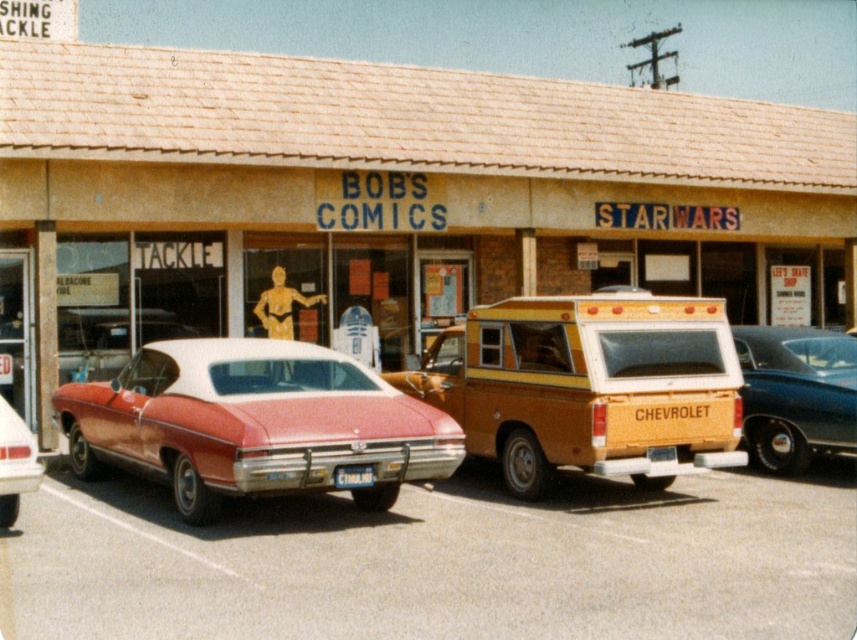
Question: Considering the relative positions of shiny red car at left and shiny blue sedan at right in the image provided, where is shiny red car at left located with respect to shiny blue sedan at right?

Choices:
 (A) left
 (B) right

Answer: (A)

Question: Which of the following is the farthest from the observer?

Choices:
 (A) matte yellow truck at center
 (B) wooden paneling camper van at center
 (C) matte red car at center

Answer: (A)

Question: Estimate the real-world distances between objects in this image. Which object is closer to the white plastic license plate at center?

Choices:
 (A) shiny red car at left
 (B) shiny blue sedan at right
 (C) wooden paneling camper van at center

Answer: (A)

Question: Observing the image, what is the correct spatial positioning of shiny blue sedan at right in reference to white plastic license plate at center?

Choices:
 (A) left
 (B) right

Answer: (B)

Question: Is shiny red car at left bigger than white plastic license plate at center?

Choices:
 (A) no
 (B) yes

Answer: (B)

Question: Considering the real-world distances, which object is farthest from the matte red car at center?

Choices:
 (A) matte yellow truck at center
 (B) wooden paneling camper van at center
 (C) shiny red car at left

Answer: (A)